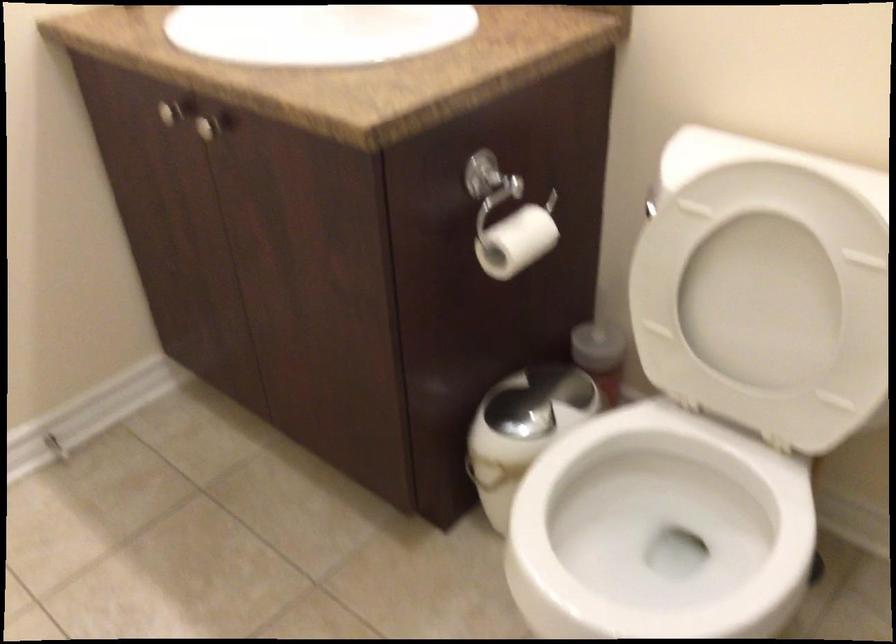
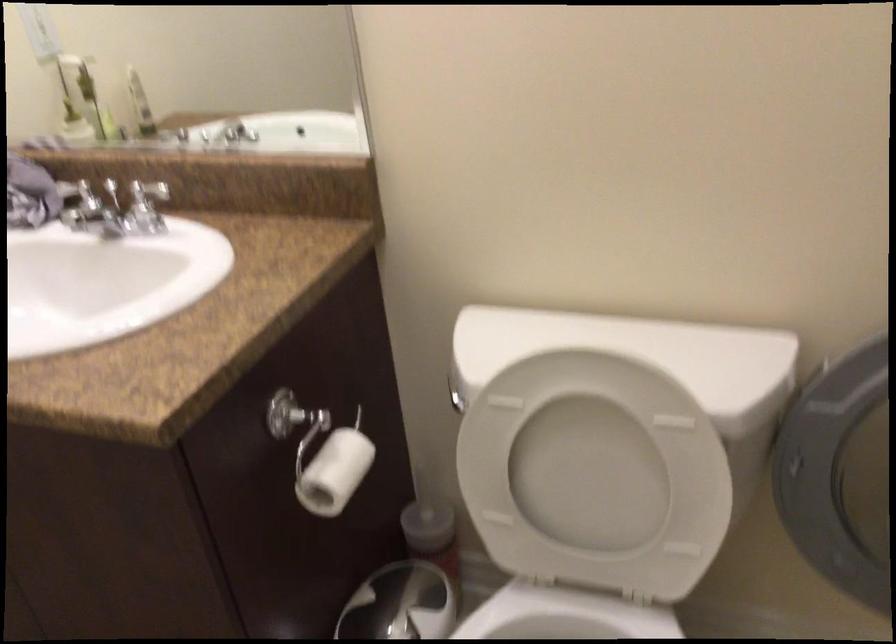
Locate, in the second image, the point that corresponds to pixel 764 307 in the first image.

(595, 475)